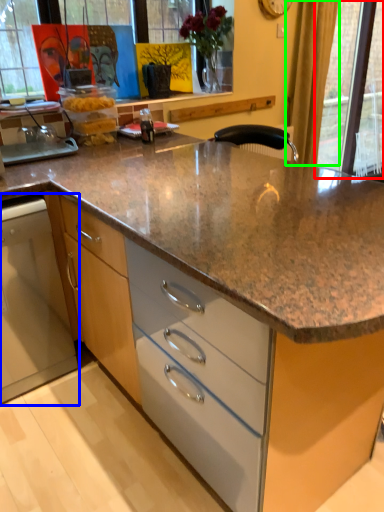
Question: Based on their relative distances, which object is farther from glass door (highlighted by a red box)? Choose from home appliance (highlighted by a blue box) and curtain (highlighted by a green box).

Choices:
 (A) home appliance
 (B) curtain

Answer: (A)